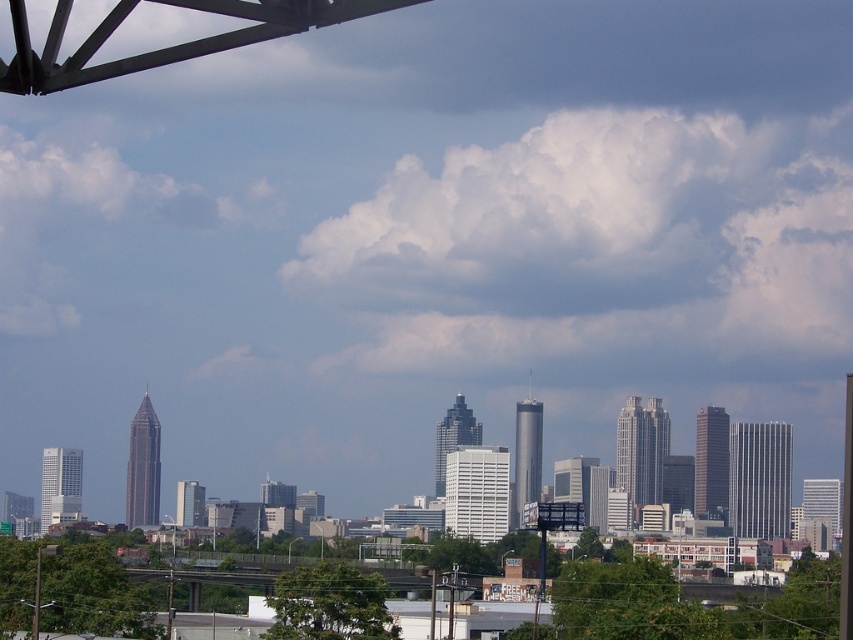
You are standing in the city and looking at the skyline. You notice two points marked in the image. Which point, point (611, 336) or point (97, 156), is closer to you?

Point (611, 336) is closer to the camera than point (97, 156).

You are standing at a viewpoint in the city and want to know the distance to a specific point in the scene. The point is labeled as point (579, 244) in the image. Can you tell me how far this point is from your current position?

The point (579, 244) is 2151.26 feet away from the viewer.

You are an airplane pilot preparing for takeoff. You notice two clouds in the sky ahead of you. The first is the white fluffy cloud at upper center, and the second is the white fluffy cloud at upper left. Which of these two clouds has a larger horizontal span when viewed from your cockpit?

The white fluffy cloud at upper center has a larger horizontal span than the white fluffy cloud at upper left because its width surpasses the latter according to the description.